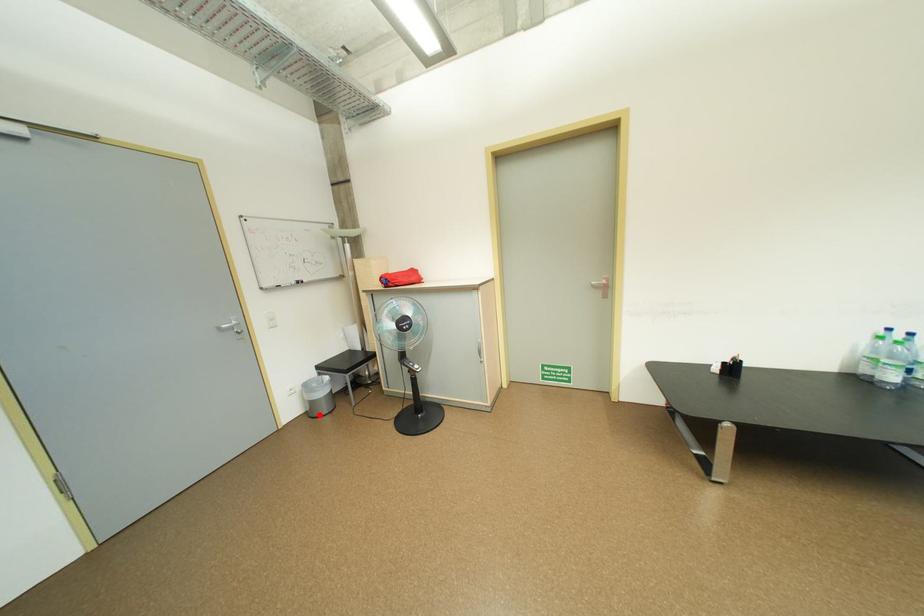
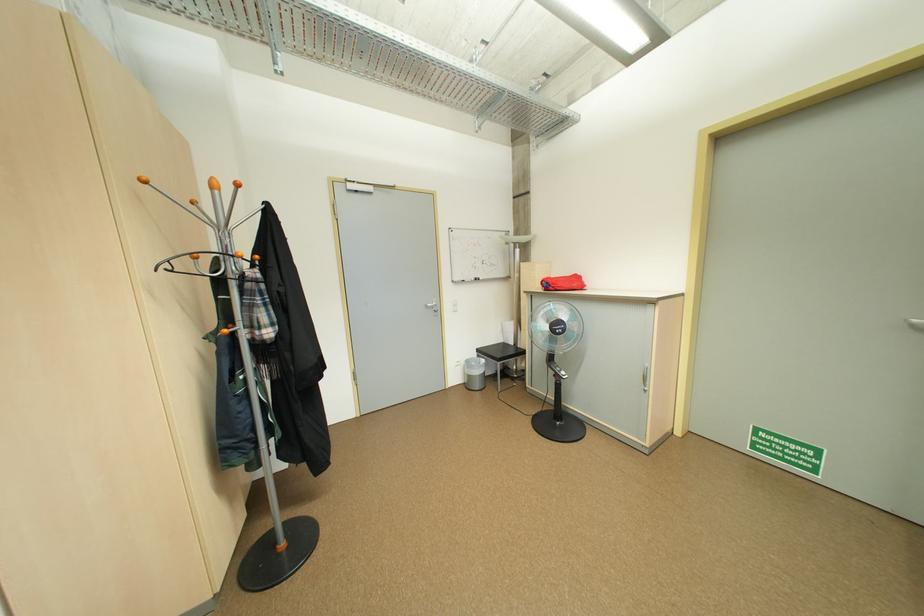
Where in the second image is the point corresponding to the highlighted location from the first image?

(476, 387)